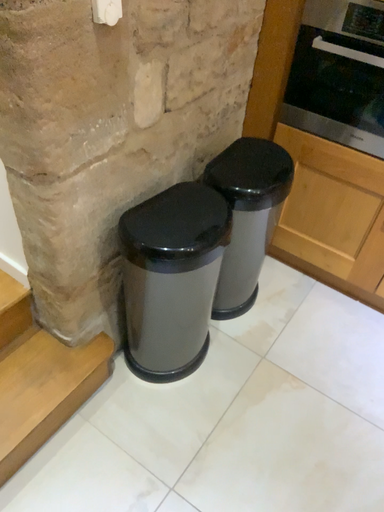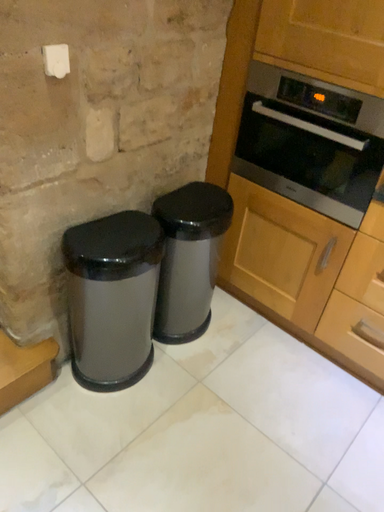
Question: Which way did the camera rotate in the video?

Choices:
 (A) rotated downward
 (B) rotated upward

Answer: (B)